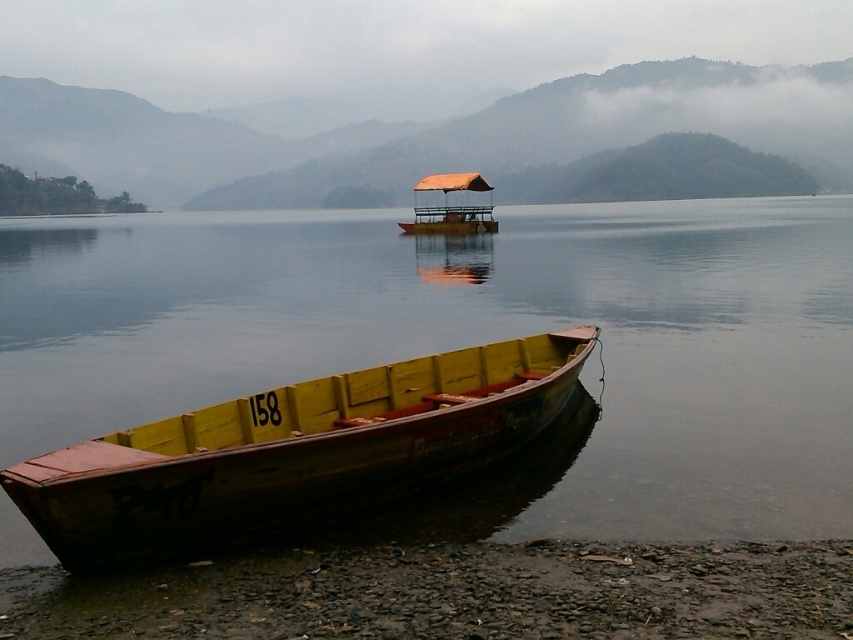
You are standing at the lakeside and want to place a small flag on the highest point between the smooth pebbles at lower left and the orange fabric boat at center. Which object should you place the flag on?

The orange fabric boat at center is taller than the smooth pebbles at lower left, so you should place the flag on the orange fabric boat at center.

You are standing at the center of the image and want to walk towards the yellow wood boat at lower left. Which direction should you move in to reach it?

Since the yellow wood boat at lower left is located at coordinates point (474, 342), you should move towards the lower left direction to reach it.

In the scene shown: You are standing on the lakeside and want to reach the orange fabric boat at center. Which direction should you walk to avoid stepping on the smooth pebbles at lower left?

The smooth pebbles at lower left are in front of the orange fabric boat at center, so to avoid them, you should walk around to the right or left side of the smooth pebbles at lower left to reach the orange fabric boat at center.